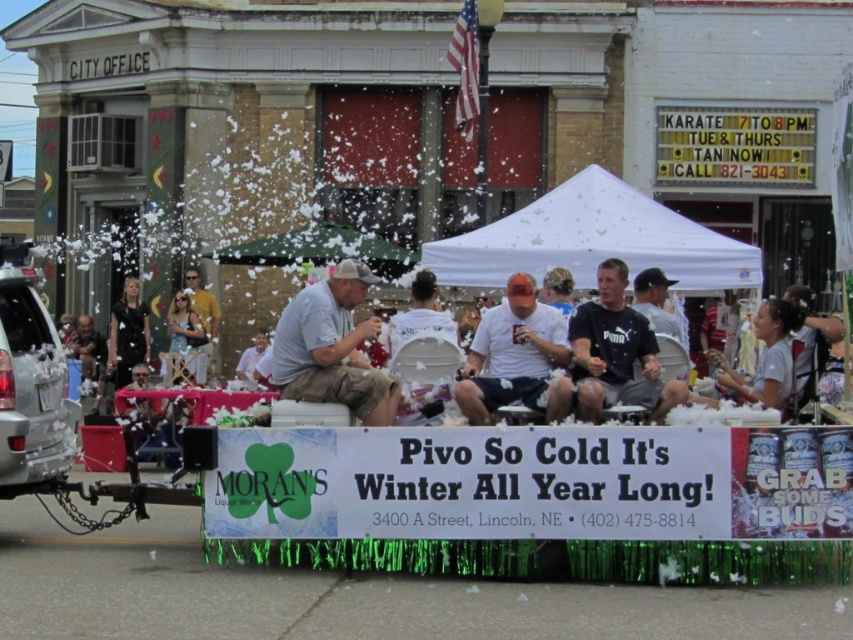
Question: Among these objects, which one is nearest to the camera?

Choices:
 (A) gray cotton shirt at center
 (B) black matte shirt at center
 (C) white fabric canopy at center
 (D) gray fabric cap at center

Answer: (B)

Question: Can you confirm if white fabric canopy at center is bigger than white matte t-shirt at center?

Choices:
 (A) no
 (B) yes

Answer: (B)

Question: Which object is farther from the camera taking this photo?

Choices:
 (A) gray cotton shirt at center
 (B) gray fabric cap at center
 (C) black matte shirt at center
 (D) white fabric canopy at center

Answer: (D)

Question: Can you confirm if white fabric canopy at center is wider than black matte shirt at center?

Choices:
 (A) yes
 (B) no

Answer: (A)

Question: Which is nearer to the black matte shirt at center?

Choices:
 (A) gray cotton shirt at center
 (B) white matte t-shirt at center

Answer: (B)

Question: Does white matte t-shirt at center lie behind black matte shirt at center?

Choices:
 (A) yes
 (B) no

Answer: (A)